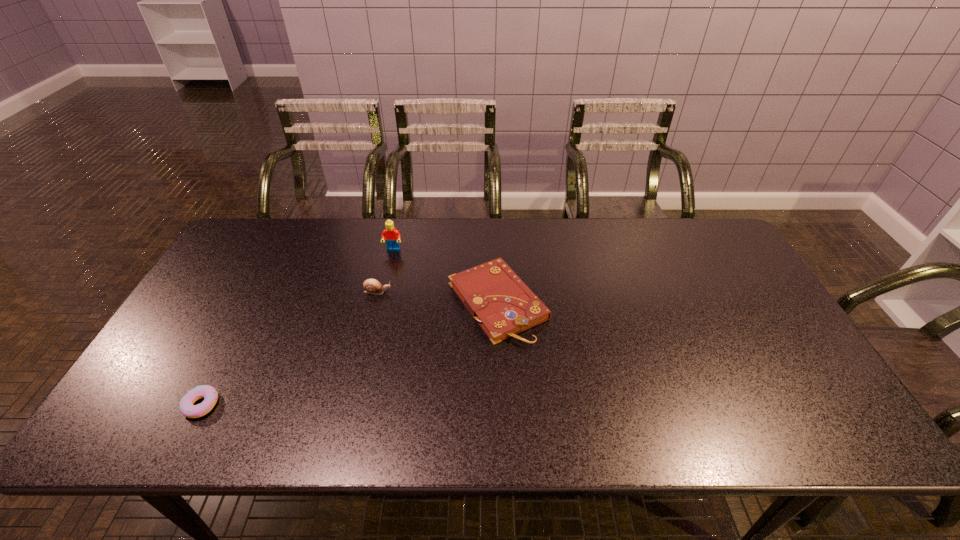
Find the location of a particular element. Image resolution: width=960 pixels, height=540 pixels. object that ranks as the third closest to the escargot is located at coordinates (209, 393).

Identify the location of free location that satisfies the following two spatial constraints: 1. on the back side of the shortest object; 2. on the right side of the rightmost object. (254, 302).

Where is `free space that satisfies the following two spatial constraints: 1. on the face of the Lego; 2. on the left side of the rightmost object`? The image size is (960, 540). free space that satisfies the following two spatial constraints: 1. on the face of the Lego; 2. on the left side of the rightmost object is located at coordinates (381, 302).

Where is `free space that satisfies the following two spatial constraints: 1. on the face of the rightmost object; 2. on the right side of the Lego`? This screenshot has width=960, height=540. free space that satisfies the following two spatial constraints: 1. on the face of the rightmost object; 2. on the right side of the Lego is located at coordinates (381, 302).

Image resolution: width=960 pixels, height=540 pixels. What are the coordinates of `vacant area in the image that satisfies the following two spatial constraints: 1. on the face of the farthest object; 2. on the front-facing side of the escargot` in the screenshot? It's located at (384, 292).

You are a GUI agent. You are given a task and a screenshot of the screen. Output one action in this format:
    pyautogui.click(x=<x>, y=<y>)
    Task: Click on the free space in the image that satisfies the following two spatial constraints: 1. on the front-facing side of the escargot; 2. on the right side of the rightmost object
    The width and height of the screenshot is (960, 540).
    Given the screenshot: What is the action you would take?
    click(x=375, y=302)

Where is `vacant point that satisfies the following two spatial constraints: 1. on the face of the notebook; 2. on the right side of the tallest object`? This screenshot has width=960, height=540. vacant point that satisfies the following two spatial constraints: 1. on the face of the notebook; 2. on the right side of the tallest object is located at coordinates (381, 302).

Where is `blank area in the image that satisfies the following two spatial constraints: 1. on the face of the rightmost object; 2. on the right side of the Lego`? The width and height of the screenshot is (960, 540). blank area in the image that satisfies the following two spatial constraints: 1. on the face of the rightmost object; 2. on the right side of the Lego is located at coordinates (381, 302).

The width and height of the screenshot is (960, 540). I want to click on free space that satisfies the following two spatial constraints: 1. on the face of the tallest object; 2. on the front-facing side of the escargot, so click(384, 292).